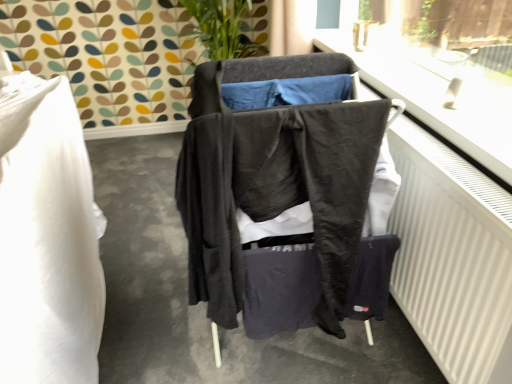
Question: Is matte black clothing at center facing away from dark gray fabric jacket at center?

Choices:
 (A) no
 (B) yes

Answer: (A)

Question: Is the position of matte black clothing at center more distant than that of dark gray fabric jacket at center?

Choices:
 (A) yes
 (B) no

Answer: (A)

Question: Considering the relative sizes of matte black clothing at center and dark gray fabric jacket at center in the image provided, is matte black clothing at center taller than dark gray fabric jacket at center?

Choices:
 (A) yes
 (B) no

Answer: (B)

Question: Does matte black clothing at center have a smaller size compared to dark gray fabric jacket at center?

Choices:
 (A) no
 (B) yes

Answer: (B)

Question: Is matte black clothing at center wider than dark gray fabric jacket at center?

Choices:
 (A) yes
 (B) no

Answer: (A)

Question: Can you confirm if matte black clothing at center is bigger than dark gray fabric jacket at center?

Choices:
 (A) yes
 (B) no

Answer: (B)

Question: Is white matte radiator at right wider than dark gray fabric jacket at center?

Choices:
 (A) yes
 (B) no

Answer: (B)

Question: Is white matte radiator at right oriented towards dark gray fabric jacket at center?

Choices:
 (A) yes
 (B) no

Answer: (A)

Question: Is white matte radiator at right looking in the opposite direction of dark gray fabric jacket at center?

Choices:
 (A) yes
 (B) no

Answer: (A)

Question: Does white matte radiator at right have a lesser width compared to dark gray fabric jacket at center?

Choices:
 (A) no
 (B) yes

Answer: (B)

Question: Can you see white matte radiator at right touching dark gray fabric jacket at center?

Choices:
 (A) no
 (B) yes

Answer: (A)

Question: From the image's perspective, is white matte radiator at right above dark gray fabric jacket at center?

Choices:
 (A) yes
 (B) no

Answer: (B)

Question: Considering the relative positions of white matte radiator at right and matte black clothing at center in the image provided, is white matte radiator at right to the left of matte black clothing at center from the viewer's perspective?

Choices:
 (A) no
 (B) yes

Answer: (A)